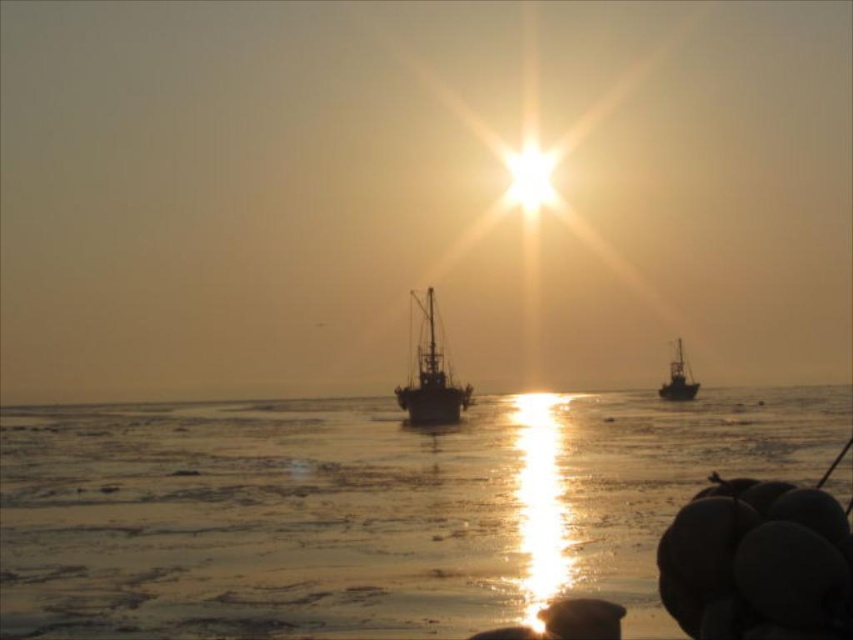
You are standing on a boat in the sunset scene and want to throw a buoy into the water. You have two points marked on your map as potential locations for the buoy. The first point is at coordinates point (828, 422) and the second is at point (682, 390). Which point is closer to your current position on the boat?

Point (828, 422) is closer to the camera than point (682, 390), so the first point is closer to your current position on the boat.

You are an observer standing on the shore of the water. You see the translucent ice at center and the silvery metallic boat at right. Which object is wider?

The translucent ice at center is wider than the silvery metallic boat at right.

You are standing on the shore observing the sunset scene. You see the dark gray metallic boat at center and the silvery metallic boat at right. Which boat appears larger in the image?

The dark gray metallic boat at center appears larger because it is closer to the viewer than the silvery metallic boat at right.